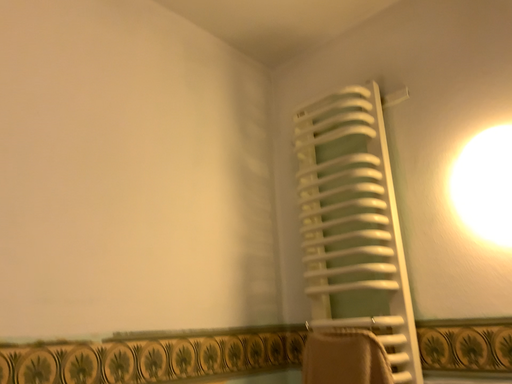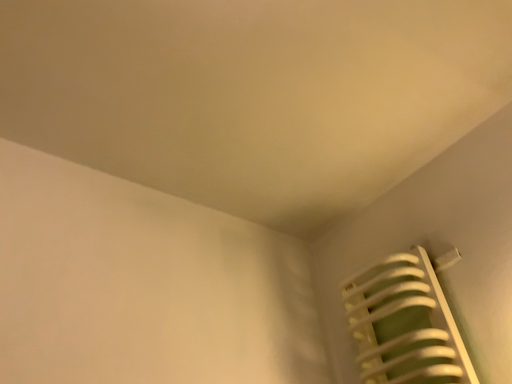
Question: How did the camera likely rotate when shooting the video?

Choices:
 (A) rotated downward
 (B) rotated upward

Answer: (B)